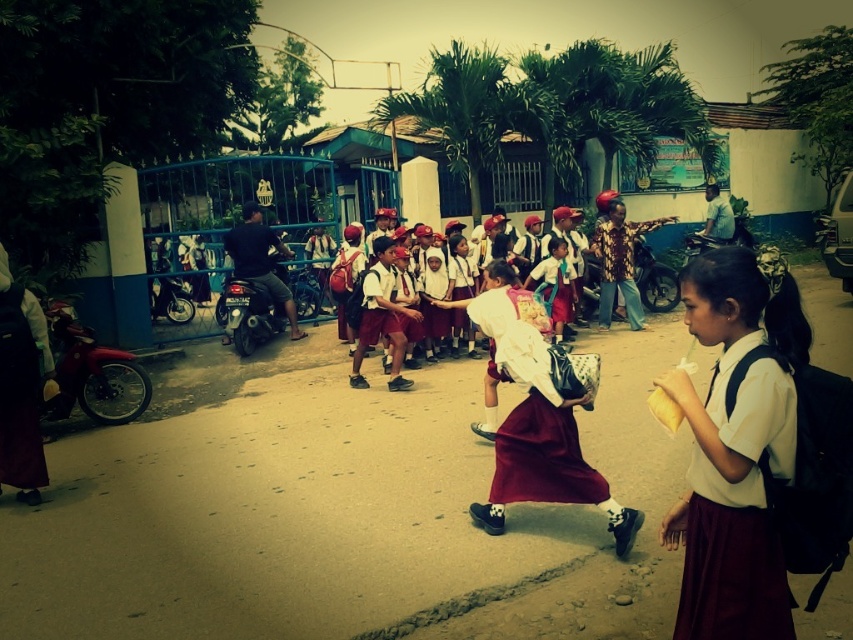
The image size is (853, 640). What are the coordinates of `maroon fabric dress at lower right` in the screenshot? It's located at (735, 508).

Does maroon fabric dress at lower right have a larger size compared to maroon skirt at center?

Incorrect, maroon fabric dress at lower right is not larger than maroon skirt at center.

Is point (717, 548) closer to viewer compared to point (538, 340)?

Yes, it is.

The image size is (853, 640). What are the coordinates of `maroon fabric dress at lower right` in the screenshot? It's located at (735, 508).

Which is more to the left, maroon fabric dress at lower right or maroon satin dress at center?

Positioned to the left is maroon satin dress at center.

Is point (757, 497) in front of point (555, 458)?

Yes.

Find the location of a particular element. The image size is (853, 640). maroon fabric dress at lower right is located at coordinates (735, 508).

Which is in front, point (546, 483) or point (500, 365)?

Point (546, 483) is more forward.

Does point (515, 324) come in front of point (502, 355)?

No, it is not.

At what (x,y) coordinates should I click in order to perform the action: click on maroon skirt at center. Please return your answer as a coordinate pair (x, y). Looking at the image, I should click on (535, 413).